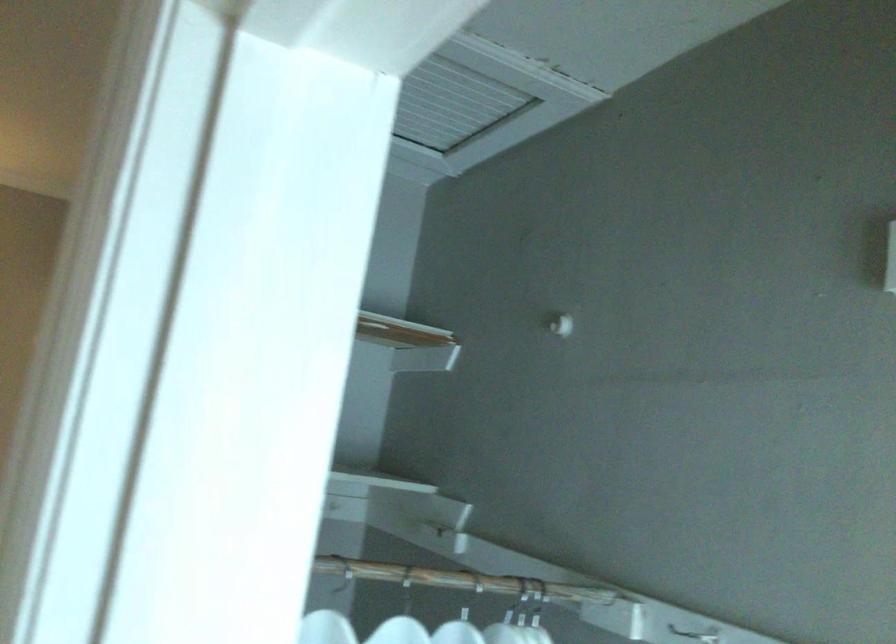
Where would you hang the white wall hook? Please return your answer as a coordinate pair (x, y).

(695, 632)